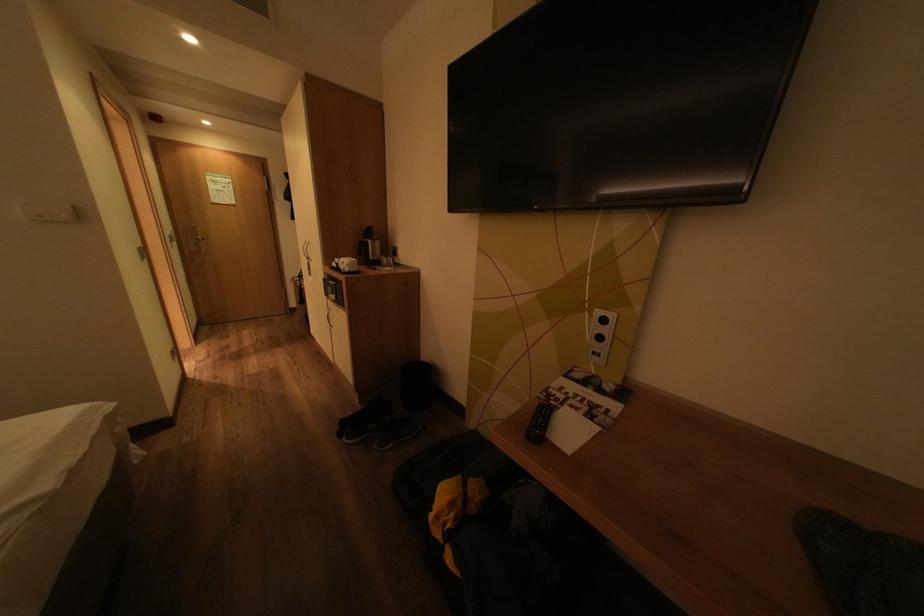
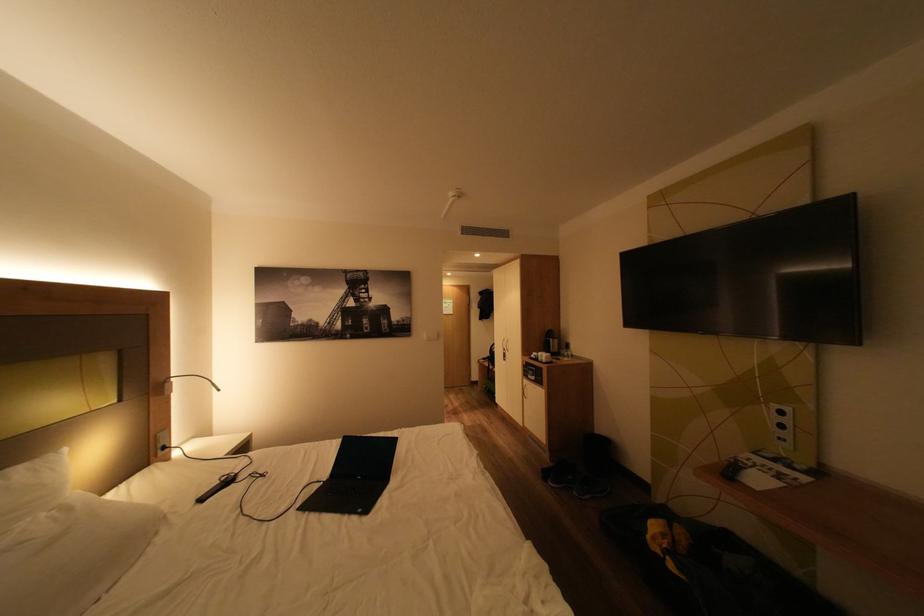
Find the pixel in the second image that matches pixel 458 525 in the first image.

(675, 546)